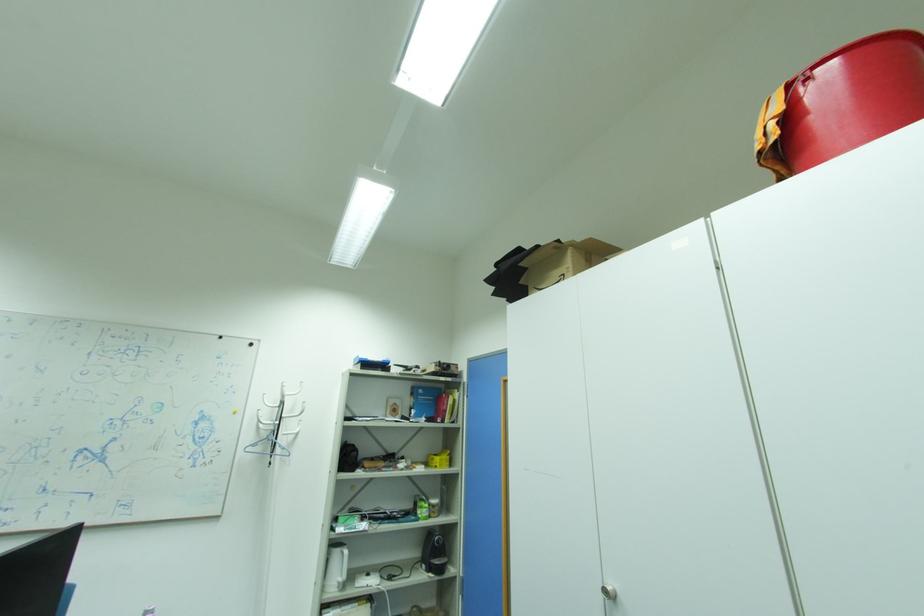
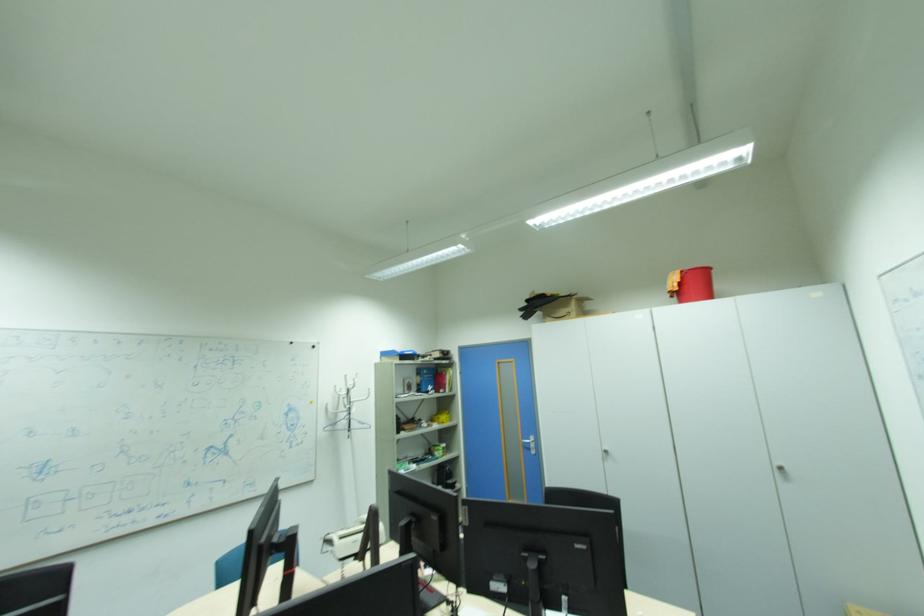
Which direction would the cameraman need to move to produce the second image?

The cameraman moved toward left, backward.